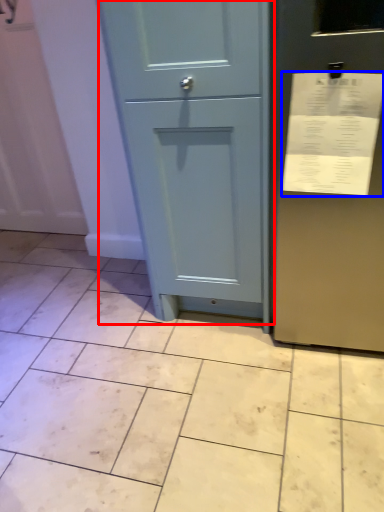
Question: Which object appears closest to the camera in this image, door (highlighted by a red box) or receipt (highlighted by a blue box)?

Choices:
 (A) door
 (B) receipt

Answer: (B)